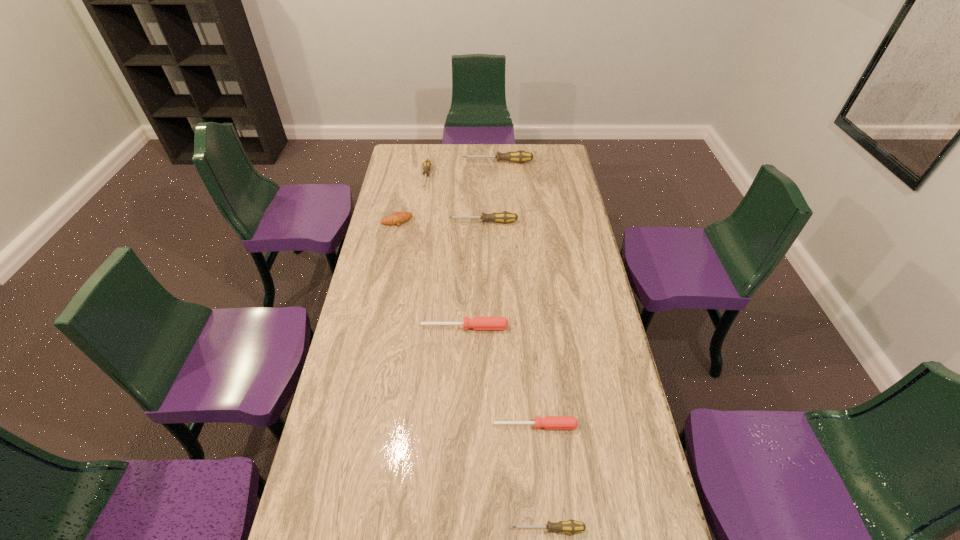
Where is `the smaller red screwdriver`? This screenshot has width=960, height=540. the smaller red screwdriver is located at coordinates (548, 422).

This screenshot has height=540, width=960. What are the coordinates of `the smallest gray screwdriver` in the screenshot? It's located at (571, 526).

Where is `the nearest gray screwdriver`? The height and width of the screenshot is (540, 960). the nearest gray screwdriver is located at coordinates (571, 526).

The image size is (960, 540). I want to click on vacant area situated at the tip of the tallest object, so click(449, 162).

The height and width of the screenshot is (540, 960). What are the coordinates of `vacant point located at the tip of the tallest object` in the screenshot? It's located at (421, 162).

Find the location of a particular element. Image resolution: width=960 pixels, height=540 pixels. free region located at the tip of the tallest object is located at coordinates (404, 162).

The image size is (960, 540). Find the location of `vacant space located 0.150m at the tip of the third smallest gray screwdriver`. vacant space located 0.150m at the tip of the third smallest gray screwdriver is located at coordinates (414, 222).

This screenshot has width=960, height=540. In order to click on free space located 0.170m at the tip of the third smallest gray screwdriver in this screenshot , I will do `click(410, 222)`.

Where is `vacant space located 0.100m at the tip of the third smallest gray screwdriver`? The width and height of the screenshot is (960, 540). vacant space located 0.100m at the tip of the third smallest gray screwdriver is located at coordinates (425, 222).

At what (x,y) coordinates should I click in order to perform the action: click on vacant space located at the tip of the sixth object from right to left. Please return your answer as a coordinate pair (x, y). Image resolution: width=960 pixels, height=540 pixels. Looking at the image, I should click on (418, 236).